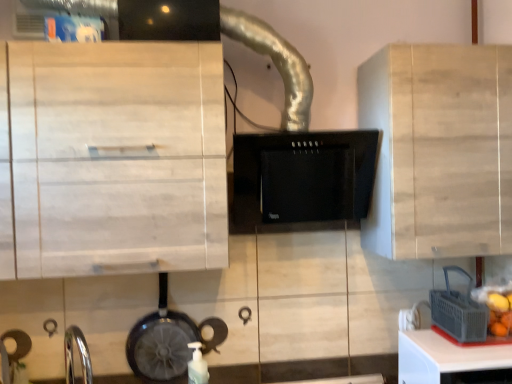
Question: From a real-world perspective, is white matte bottle at lower center beneath shiny black frying pan at lower left?

Choices:
 (A) yes
 (B) no

Answer: (A)

Question: From the image's perspective, is white matte bottle at lower center below shiny black frying pan at lower left?

Choices:
 (A) yes
 (B) no

Answer: (A)

Question: Is white matte bottle at lower center with shiny black frying pan at lower left?

Choices:
 (A) no
 (B) yes

Answer: (A)

Question: From a real-world perspective, does white matte bottle at lower center stand above shiny black frying pan at lower left?

Choices:
 (A) yes
 (B) no

Answer: (B)

Question: Could you tell me if white matte bottle at lower center is turned towards shiny black frying pan at lower left?

Choices:
 (A) yes
 (B) no

Answer: (B)

Question: Can you confirm if white matte bottle at lower center is smaller than shiny black frying pan at lower left?

Choices:
 (A) yes
 (B) no

Answer: (A)

Question: Could you tell me if shiny black frying pan at lower left is turned towards black matte range hood at center?

Choices:
 (A) yes
 (B) no

Answer: (B)

Question: From the image's perspective, would you say shiny black frying pan at lower left is shown under black matte range hood at center?

Choices:
 (A) yes
 (B) no

Answer: (A)

Question: Does shiny black frying pan at lower left lie behind black matte range hood at center?

Choices:
 (A) yes
 (B) no

Answer: (A)

Question: From a real-world perspective, is shiny black frying pan at lower left below black matte range hood at center?

Choices:
 (A) yes
 (B) no

Answer: (A)

Question: Is shiny black frying pan at lower left far from black matte range hood at center?

Choices:
 (A) yes
 (B) no

Answer: (B)

Question: Can you confirm if shiny black frying pan at lower left is shorter than black matte range hood at center?

Choices:
 (A) no
 (B) yes

Answer: (A)

Question: Can you confirm if light wood cabinet at upper left, placed as the first cabinetry when sorted from left to right, is positioned to the left of white plastic table at lower right?

Choices:
 (A) yes
 (B) no

Answer: (A)